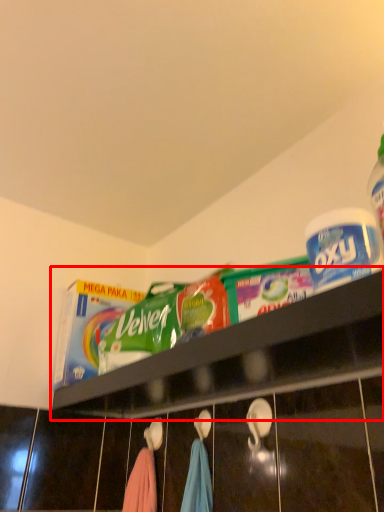
Question: From the image's perspective, what is the correct spatial positioning of shelf (annotated by the red box) in reference to product?

Choices:
 (A) below
 (B) above

Answer: (A)